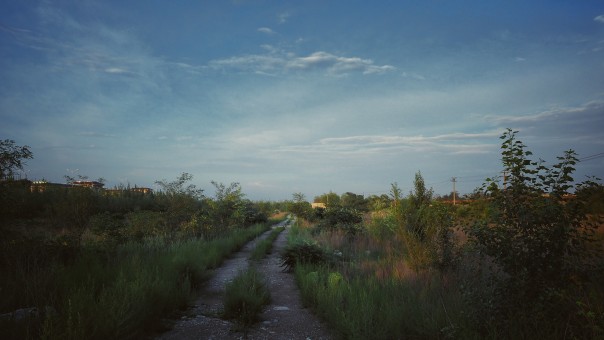
Where is `wires`? wires is located at coordinates (487, 177), (432, 181).